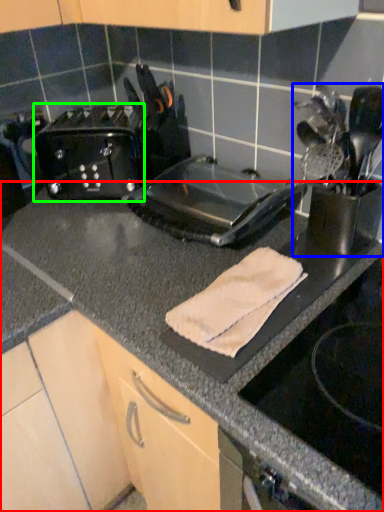
Question: Based on their relative distances, which object is farther from countertop (highlighted by a red box)? Choose from appliance (highlighted by a blue box) and toaster (highlighted by a green box).

Choices:
 (A) appliance
 (B) toaster

Answer: (B)